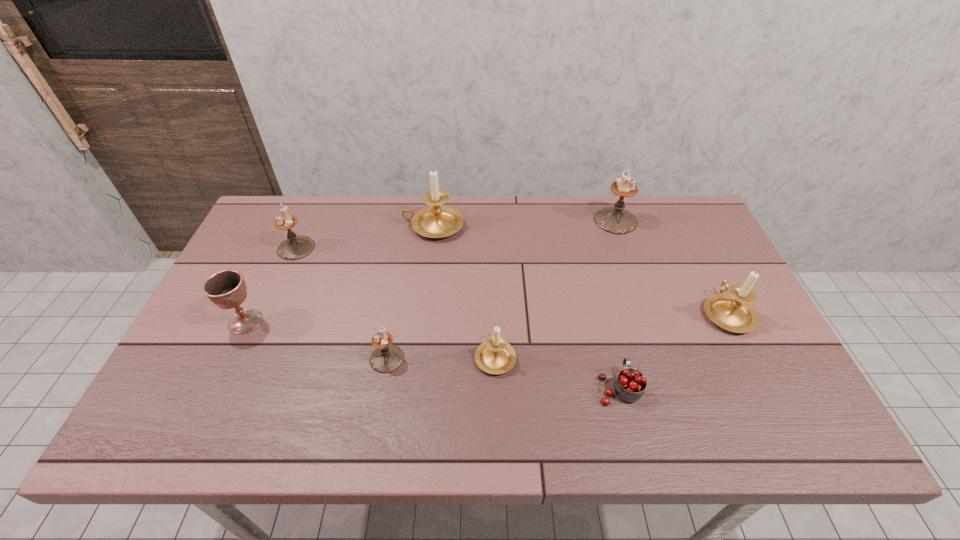
I want to click on free space in the image that satisfies the following two spatial constraints: 1. with a handle on the side of the farthest beige candle holder; 2. with a handle on the side of the fifth object from left to right, so click(419, 356).